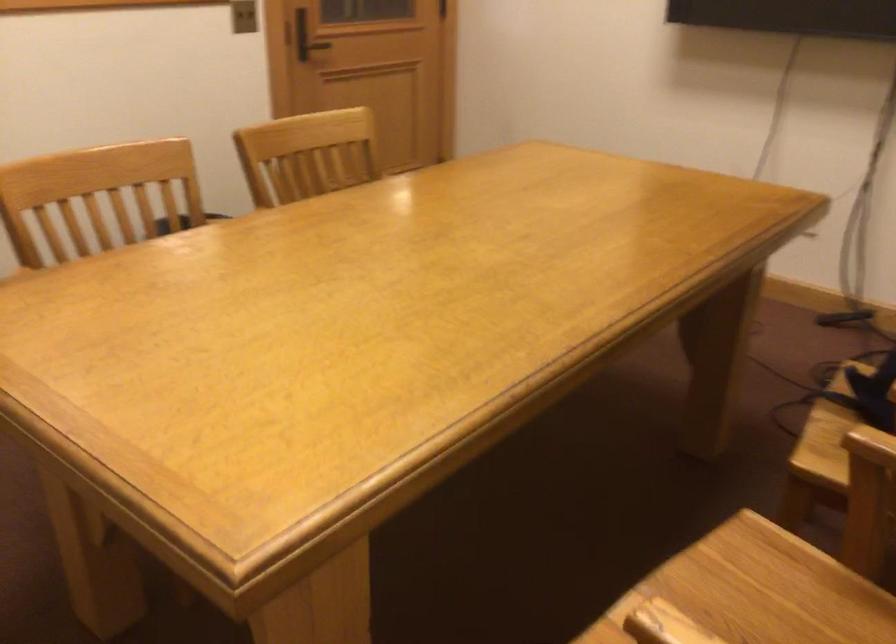
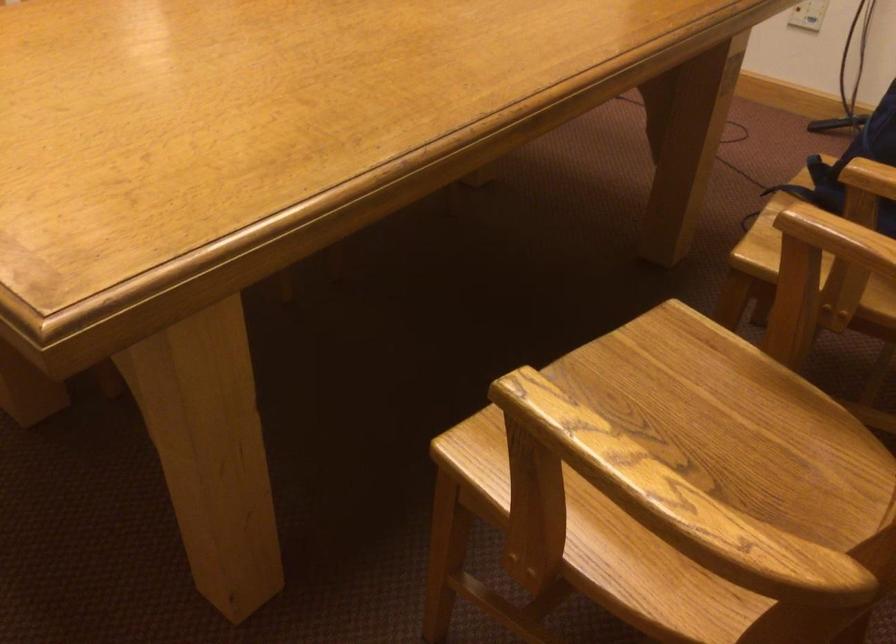
In a continuous first-person perspective shot, in which direction is the camera moving?

The cameraman walked toward right, forward.